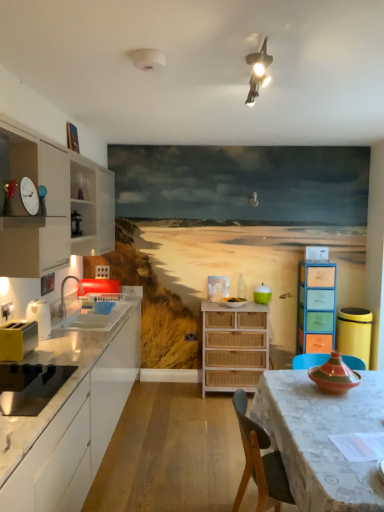
The width and height of the screenshot is (384, 512). I want to click on vacant region in front of multicolored ceramic vase at table, arranged as the 2th appliance when viewed from the right, so click(342, 408).